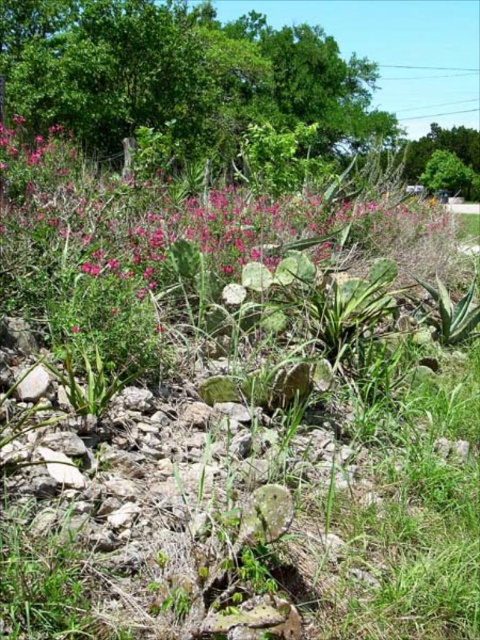
Is green leafy tree at upper center positioned behind pink matte flowers at center?

Yes, it is behind pink matte flowers at center.

Does green leafy tree at upper center have a larger size compared to pink matte flowers at center?

Yes, green leafy tree at upper center is bigger than pink matte flowers at center.

Which is behind, point (166, 83) or point (241, 259)?

Point (166, 83)

Where is `green leafy tree at upper center`? The width and height of the screenshot is (480, 640). green leafy tree at upper center is located at coordinates (181, 76).

Is green leafy tree at upper center positioned in front of green leafy tree at upper right?

Yes, green leafy tree at upper center is closer to the viewer.

Is point (100, 116) less distant than point (456, 131)?

Yes, point (100, 116) is closer to viewer.

At what (x,y) coordinates should I click in order to perform the action: click on green leafy tree at upper center. Please return your answer as a coordinate pair (x, y). Image resolution: width=480 pixels, height=640 pixels. Looking at the image, I should click on pyautogui.click(x=181, y=76).

In the scene shown: Which of these two, pink matte flowers at center or green leafy tree at upper right, stands shorter?

With less height is green leafy tree at upper right.

Who is positioned more to the right, pink matte flowers at center or green leafy tree at upper right?

green leafy tree at upper right

Find the location of `pink matte flowers at center`. pink matte flowers at center is located at coordinates (188, 220).

Find the location of `pink matte flowers at center`. pink matte flowers at center is located at coordinates (188, 220).